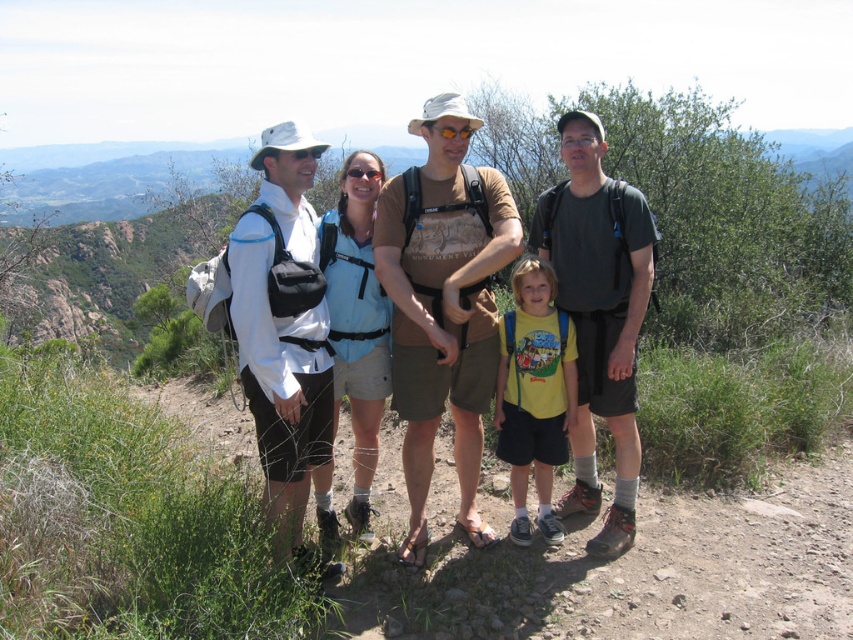
Is matte black backpack at center to the left of brown cotton t-shirt at center from the viewer's perspective?

Indeed, matte black backpack at center is positioned on the left side of brown cotton t-shirt at center.

Who is taller, matte black backpack at center or brown cotton t-shirt at center?

matte black backpack at center is taller.

Does point (461, 387) lie behind point (453, 118)?

That is True.

Locate an element on the screen. Image resolution: width=853 pixels, height=640 pixels. matte black backpack at center is located at coordinates (444, 304).

Based on the photo, is matte black backpack at center below dark gray t-shirt at center?

Incorrect, matte black backpack at center is not positioned below dark gray t-shirt at center.

Find the location of a particular element. The width and height of the screenshot is (853, 640). matte black backpack at center is located at coordinates (444, 304).

Where is `matte black backpack at center`? matte black backpack at center is located at coordinates (444, 304).

Find the location of a particular element. dark gray t-shirt at center is located at coordinates [x=599, y=314].

Does point (555, 227) come farther from viewer compared to point (503, 387)?

Yes, point (555, 227) is farther from viewer.

Locate an element on the screen. This screenshot has width=853, height=640. dark gray t-shirt at center is located at coordinates (599, 314).